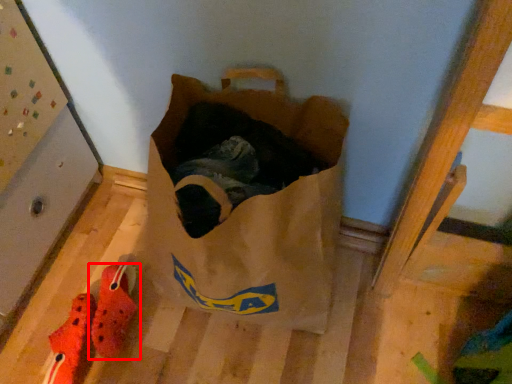
Question: Observing the image, what is the correct spatial positioning of footwear (annotated by the red box) in reference to footwear?

Choices:
 (A) left
 (B) right

Answer: (B)